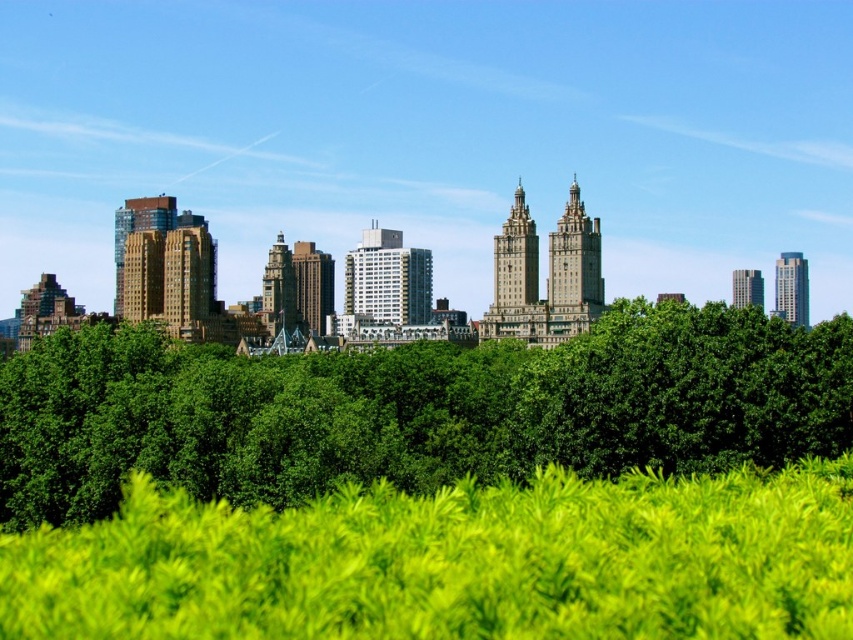
Question: Which object appears farthest from the camera in this image?

Choices:
 (A) green leafy grass at center
 (B) green leafy trees at center

Answer: (B)

Question: Does green leafy trees at center appear over green leafy grass at center?

Choices:
 (A) yes
 (B) no

Answer: (A)

Question: Is green leafy trees at center to the left of green leafy grass at center from the viewer's perspective?

Choices:
 (A) yes
 (B) no

Answer: (B)

Question: Which of the following is the closest to the observer?

Choices:
 (A) green leafy trees at center
 (B) green leafy grass at center

Answer: (B)

Question: Does green leafy trees at center appear on the left side of green leafy grass at center?

Choices:
 (A) no
 (B) yes

Answer: (A)